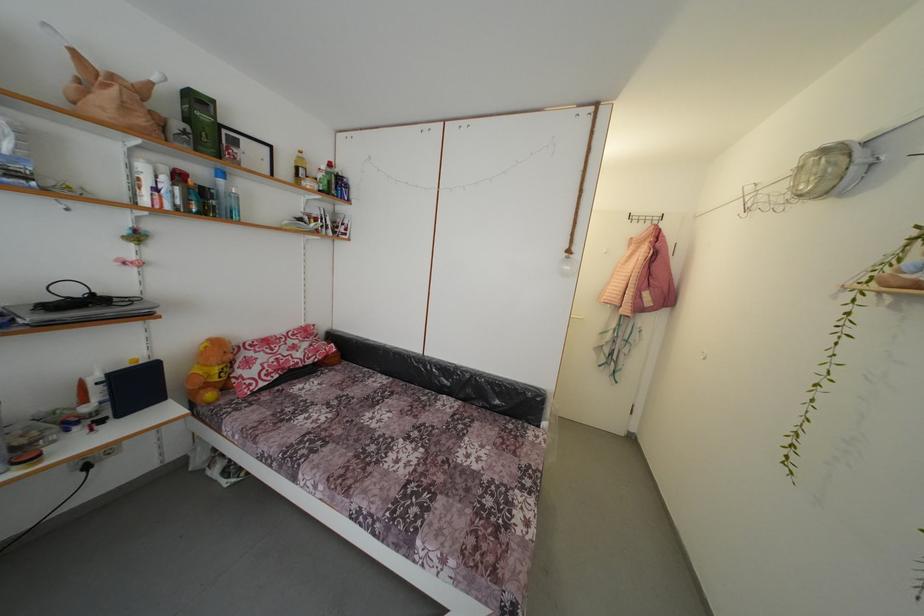
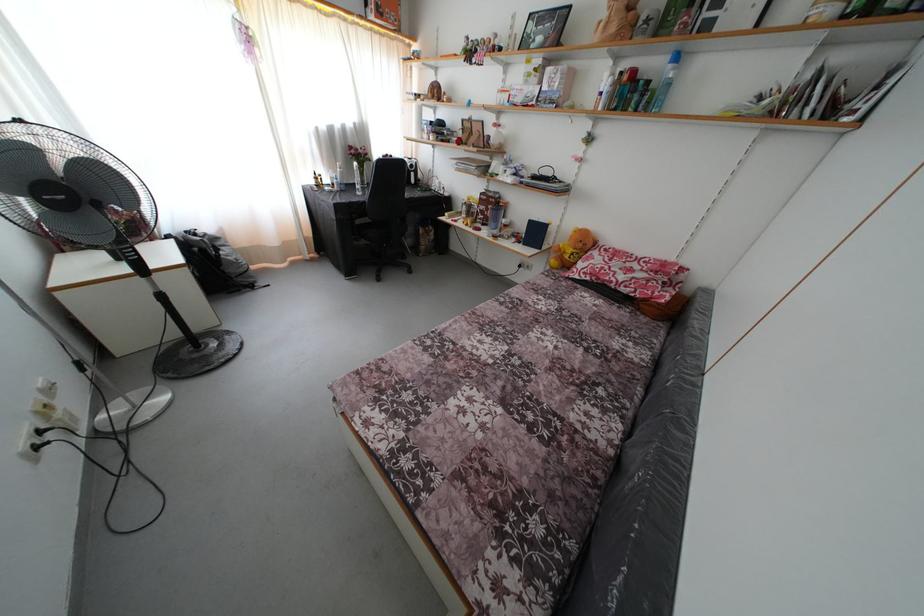
Where in the second image is the point corresponding to (x=225, y=187) from the first image?

(675, 73)